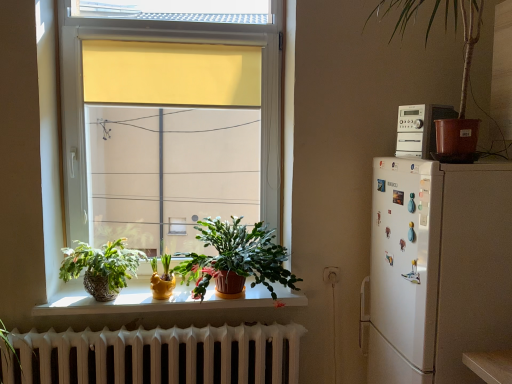
Question: Can you confirm if textured wicker basket at lower left, arranged as the 3th houseplant when viewed from the top, is thinner than matte yellow pot at window, the 4th houseplant from the top?

Choices:
 (A) yes
 (B) no

Answer: (B)

Question: From a real-world perspective, is textured wicker basket at lower left, arranged as the 3th houseplant when viewed from the top, on top of matte yellow pot at window, the third houseplant positioned from the right?

Choices:
 (A) no
 (B) yes

Answer: (B)

Question: Considering the relative sizes of textured wicker basket at lower left, arranged as the 3th houseplant when viewed from the top, and matte yellow pot at window, the 1th houseplant when ordered from bottom to top, in the image provided, is textured wicker basket at lower left, arranged as the 3th houseplant when viewed from the top, bigger than matte yellow pot at window, the 1th houseplant when ordered from bottom to top,?

Choices:
 (A) no
 (B) yes

Answer: (B)

Question: From the image's perspective, is textured wicker basket at lower left, arranged as the 3th houseplant when viewed from the top, beneath matte yellow pot at window, which ranks as the 2th houseplant in left-to-right order?

Choices:
 (A) no
 (B) yes

Answer: (A)

Question: Can we say textured wicker basket at lower left, arranged as the 3th houseplant when viewed from the top, lies outside matte yellow pot at window, the 4th houseplant from the top?

Choices:
 (A) no
 (B) yes

Answer: (B)

Question: Is textured wicker basket at lower left, arranged as the fourth houseplant when viewed from the right, oriented towards matte yellow pot at window, the third houseplant positioned from the right?

Choices:
 (A) yes
 (B) no

Answer: (B)

Question: Is brown plastic pot at upper right, the fourth houseplant positioned from the bottom, not inside textured wicker basket at lower left, arranged as the first houseplant when viewed from the left?

Choices:
 (A) yes
 (B) no

Answer: (A)

Question: Can you confirm if brown plastic pot at upper right, which ranks as the fourth houseplant in left-to-right order, is bigger than textured wicker basket at lower left, arranged as the 3th houseplant when viewed from the top?

Choices:
 (A) no
 (B) yes

Answer: (B)

Question: From a real-world perspective, is brown plastic pot at upper right, arranged as the 1th houseplant when viewed from the right, on top of textured wicker basket at lower left, arranged as the 3th houseplant when viewed from the top?

Choices:
 (A) no
 (B) yes

Answer: (B)

Question: Is brown plastic pot at upper right, acting as the first houseplant starting from the top, oriented towards textured wicker basket at lower left, arranged as the 3th houseplant when viewed from the top?

Choices:
 (A) no
 (B) yes

Answer: (A)

Question: From the image's perspective, is brown plastic pot at upper right, arranged as the 1th houseplant when viewed from the right, on top of textured wicker basket at lower left, arranged as the first houseplant when viewed from the left?

Choices:
 (A) yes
 (B) no

Answer: (A)

Question: Is brown plastic pot at upper right, arranged as the 1th houseplant when viewed from the right, to the left of textured wicker basket at lower left, arranged as the first houseplant when viewed from the left, from the viewer's perspective?

Choices:
 (A) yes
 (B) no

Answer: (B)

Question: Is matte yellow pot at window, the third houseplant positioned from the right, bigger than white matte stereo at upper right?

Choices:
 (A) yes
 (B) no

Answer: (B)